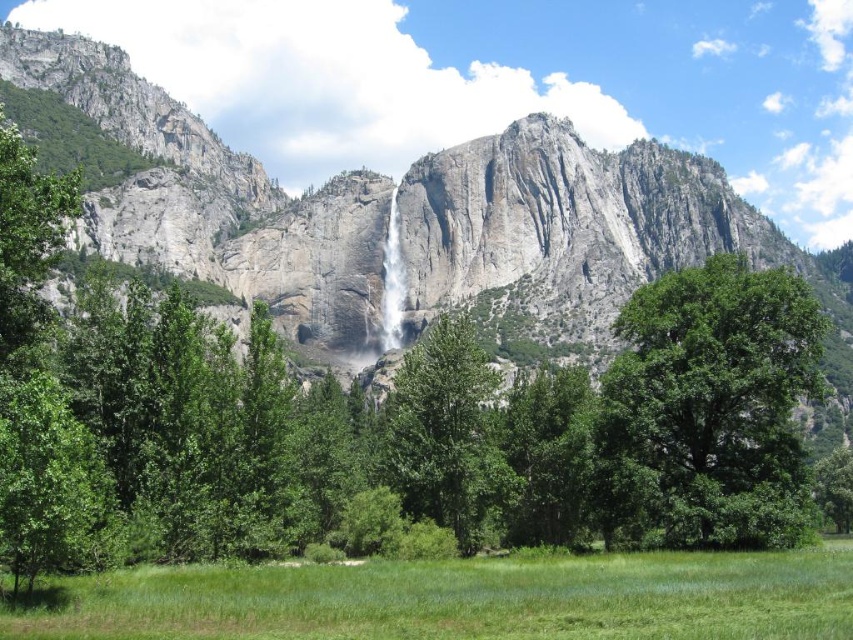
Which is more to the right, gray rock waterfall at center or green leafy tree at center?

green leafy tree at center is more to the right.

Is gray rock waterfall at center bigger than green leafy tree at center?

Indeed, gray rock waterfall at center has a larger size compared to green leafy tree at center.

What do you see at coordinates (424, 227) in the screenshot? This screenshot has width=853, height=640. I see `gray rock waterfall at center` at bounding box center [424, 227].

This screenshot has height=640, width=853. In order to click on gray rock waterfall at center in this screenshot , I will do `click(424, 227)`.

Measure the distance between green grassy pasture at lower center and white smooth waterfall at center.

green grassy pasture at lower center and white smooth waterfall at center are 88.66 meters apart from each other.

Does green grassy pasture at lower center appear under white smooth waterfall at center?

Yes.

Who is more forward, [376,566] or [387,291]?

Point [376,566] is in front.

I want to click on green grassy pasture at lower center, so click(x=467, y=600).

Is gray rock waterfall at center shorter than green leafy tree at right?

No, gray rock waterfall at center is not shorter than green leafy tree at right.

Is gray rock waterfall at center smaller than green leafy tree at right?

Actually, gray rock waterfall at center might be larger than green leafy tree at right.

Which is in front, point (451, 179) or point (670, 540)?

Positioned in front is point (670, 540).

At what (x,y) coordinates should I click in order to perform the action: click on gray rock waterfall at center. Please return your answer as a coordinate pair (x, y). This screenshot has width=853, height=640. Looking at the image, I should click on (424, 227).